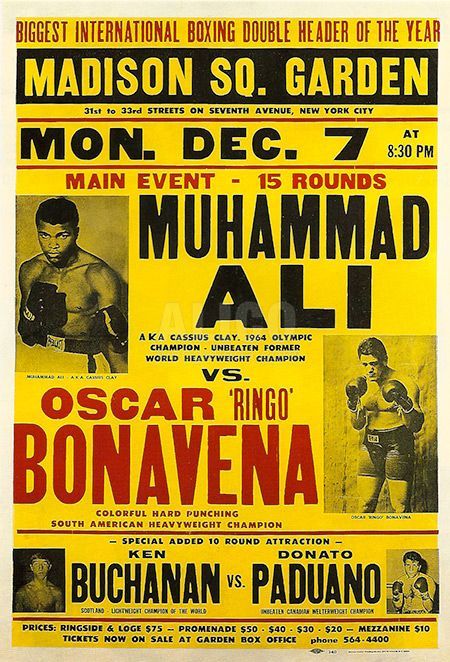
In order to click on cream border in this screenshot , I will do `click(131, 651)`.